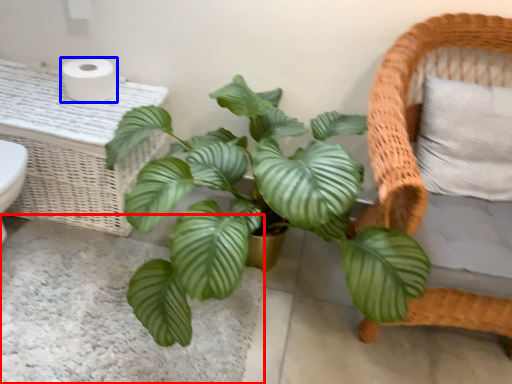
Question: Which of the following is the farthest to the observer, plain (highlighted by a red box) or toilet paper (highlighted by a blue box)?

Choices:
 (A) plain
 (B) toilet paper

Answer: (B)